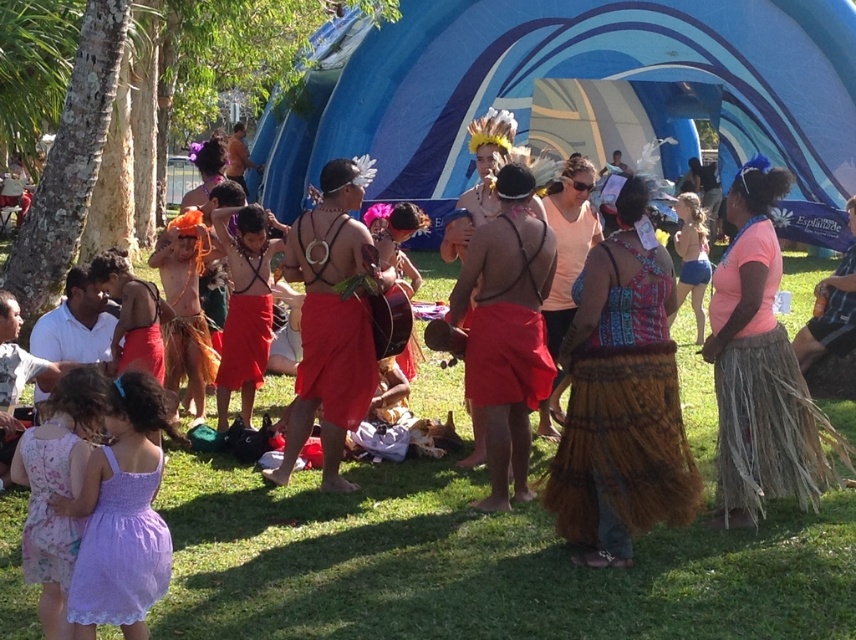
Between lavender lace dress at lower left and brown woven skirt at lower right, which one appears on the right side from the viewer's perspective?

brown woven skirt at lower right

Which is more to the left, lavender lace dress at lower left or brown woven skirt at lower right?

lavender lace dress at lower left

Between point (147, 484) and point (847, 321), which one is positioned in front?

Point (147, 484) is in front.

The image size is (856, 640). I want to click on lavender lace dress at lower left, so click(120, 550).

Can you confirm if brown woven skirt at center is positioned to the right of red woven skirt at center?

Indeed, brown woven skirt at center is positioned on the right side of red woven skirt at center.

Does point (587, 470) lie behind point (512, 310)?

No, (587, 470) is in front of (512, 310).

You are a GUI agent. You are given a task and a screenshot of the screen. Output one action in this format:
    pyautogui.click(x=<x>, y=<y>)
    Task: Click on the brown woven skirt at center
    
    Given the screenshot: What is the action you would take?
    (x=621, y=397)

Who is more distant from viewer, [742,332] or [308,227]?

The point [308,227] is more distant.

Between pink woven grass skirt at center and red fabric skirt at center, which one is positioned lower?

pink woven grass skirt at center

Image resolution: width=856 pixels, height=640 pixels. I want to click on pink woven grass skirt at center, so click(x=758, y=365).

This screenshot has height=640, width=856. In order to click on pink woven grass skirt at center in this screenshot , I will do click(758, 365).